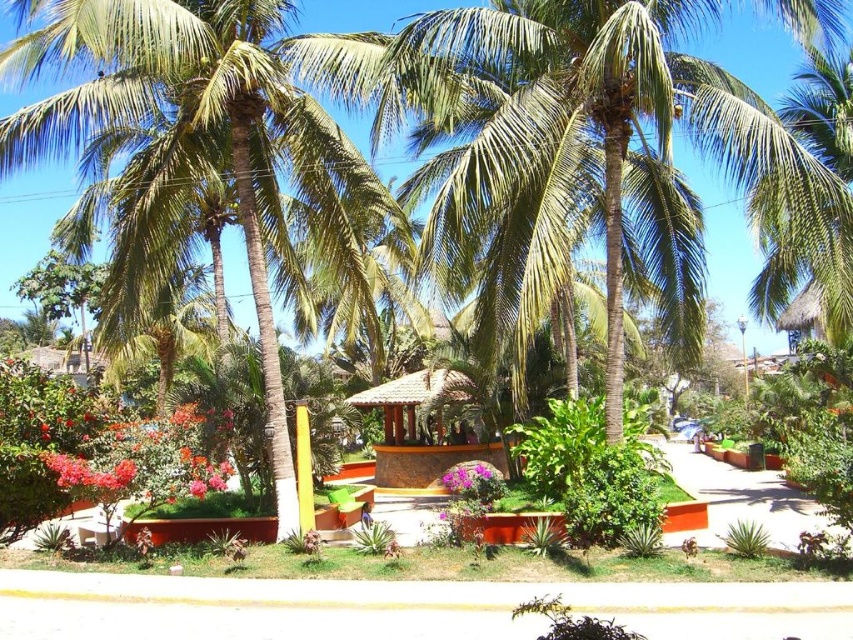
You are planning to install a bird feeder in the garden shown. The bird feeder requires a support structure that must be at least 2 meters tall. Based on the image, can the green leafy coconut tree at center and the bright red petals at lower left provide suitable support for the bird feeder?

The green leafy coconut tree at center is taller than bright red petals at lower left. Since the bird feeder requires a support structure at least 2 meters tall, the green leafy coconut tree at center is suitable, but the bright red petals at lower left may not be tall enough.

You are planning to install a sprinkler system in this garden. The sprinkler can water an area up to 5 meters away from its position. If you place the sprinkler exactly at the bright red petals at lower left, will the green leafy coconut tree at center be within the watering range of the sprinkler?

The distance between the green leafy coconut tree at center and the bright red petals at lower left is 4.81 meters. Since the sprinkler can water up to 5 meters, the green leafy coconut tree at center will be within the watering range.